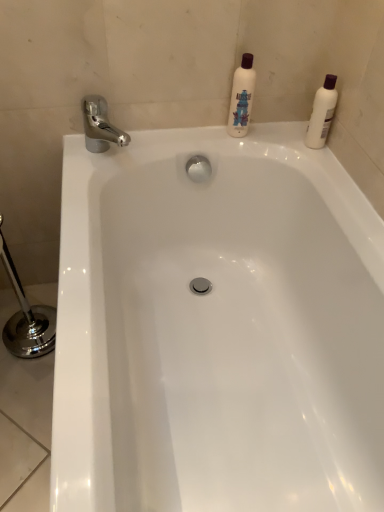
The image size is (384, 512). Identify the location of space that is in front of white plastic bottle at upper right, positioned as the 1th cleaning product in right-to-left order. (326, 167).